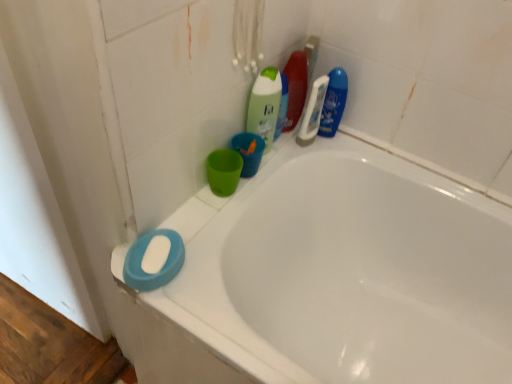
Question: Is point click(x=141, y=266) closer or farther from the camera than point click(x=270, y=77)?

Choices:
 (A) closer
 (B) farther

Answer: (A)

Question: Considering the positions of white matte soap at lower left and green matte bottle at upper center, the first cleaning product positioned from the left, in the image, is white matte soap at lower left bigger or smaller than green matte bottle at upper center, the first cleaning product positioned from the left,?

Choices:
 (A) big
 (B) small

Answer: (B)

Question: Which is nearer to the translucent plastic bottle at upper center, which is counted as the second cleaning product, starting from the left?

Choices:
 (A) white matte soap at lower left
 (B) white plastic toothbrush at upper center, the third cleaning product when ordered from left to right
 (C) green matte bottle at upper center, the first cleaning product positioned from the left
 (D) matte plastic cup at upper center
 (E) white glossy bathtub at lower left

Answer: (B)

Question: Based on their relative distances, which object is nearer to the white plastic toothbrush at upper center, the third cleaning product when ordered from left to right?

Choices:
 (A) blue glossy bottle at upper right, the 4th cleaning product from the left
 (B) white matte soap at lower left
 (C) green matte bottle at upper center, the fourth cleaning product when ordered from right to left
 (D) translucent plastic bottle at upper center, the third cleaning product positioned from the right
 (E) matte plastic cup at upper center

Answer: (A)